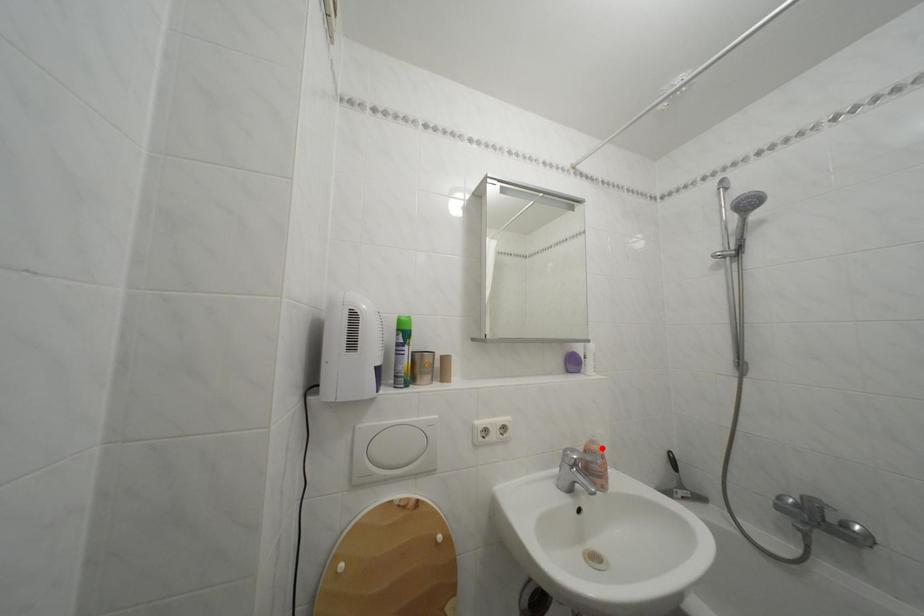
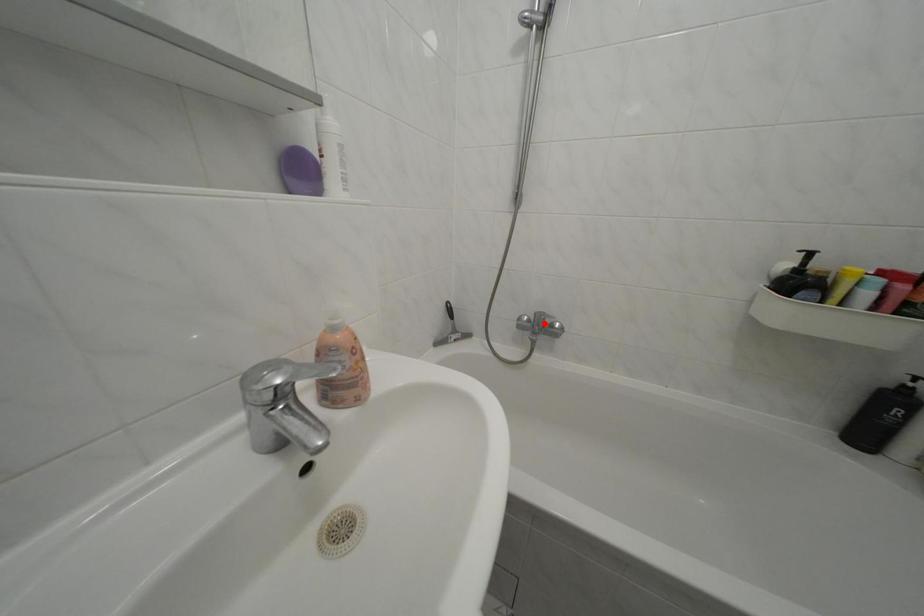
I am providing you with two images of the same scene from different viewpoints. A red point is marked on the first image and another point is marked on the second image. Does the point marked in image1 correspond to the same location as the one in image2?

No